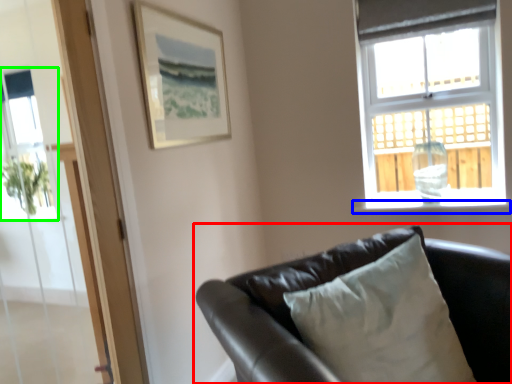
Question: Estimate the real-world distances between objects in this image. Which object is closer to studio couch (highlighted by a red box), window sill (highlighted by a blue box) or window screen (highlighted by a green box)?

Choices:
 (A) window sill
 (B) window screen

Answer: (A)